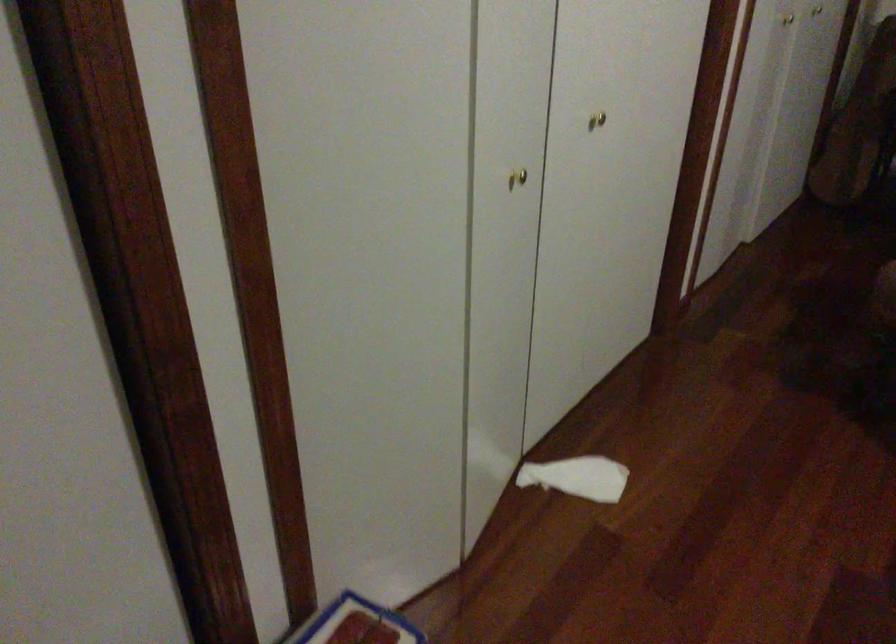
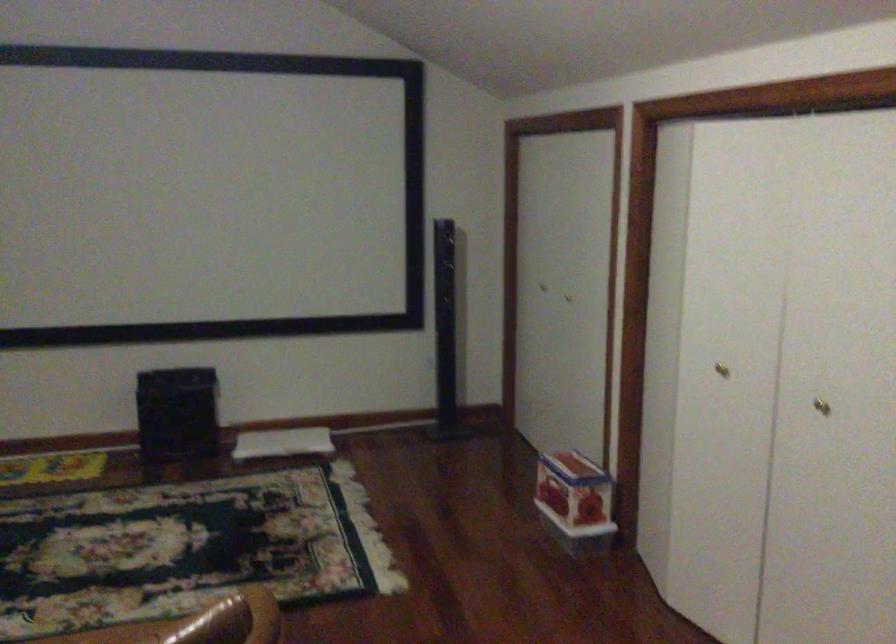
The point at [509,176] is marked in the first image. Where is the corresponding point in the second image?

(721, 368)